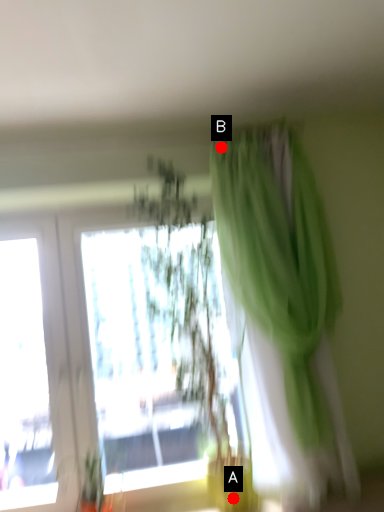
Question: Two points are circled on the image, labeled by A and B beside each circle. Which point is further to the camera?

Choices:
 (A) A is further
 (B) B is further

Answer: (A)